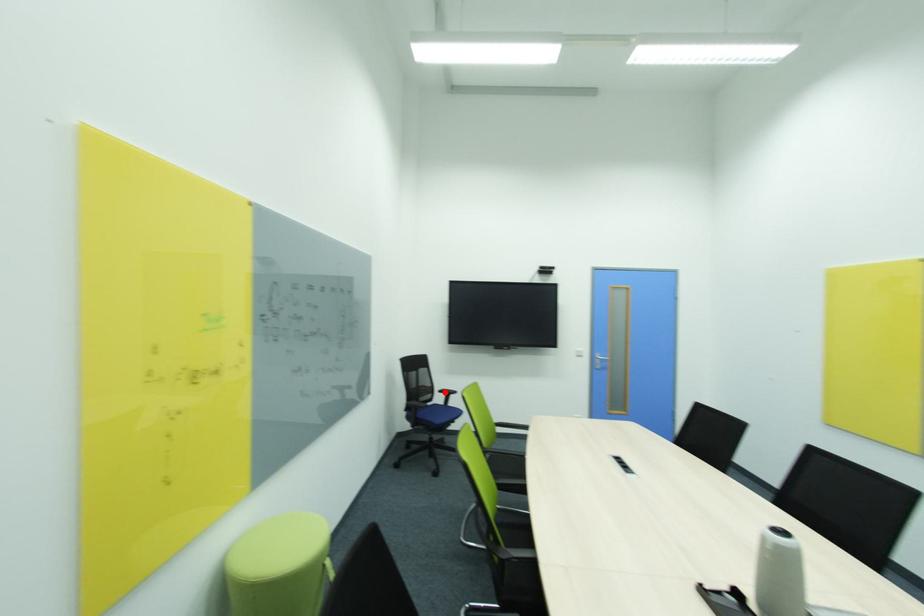
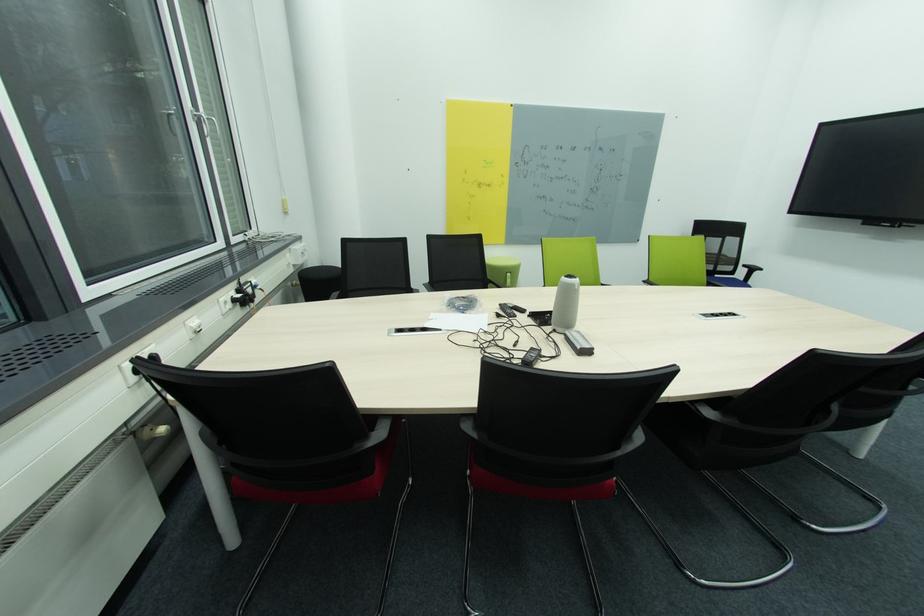
In the second image, find the point that corresponds to the highlighted location in the first image.

(749, 267)